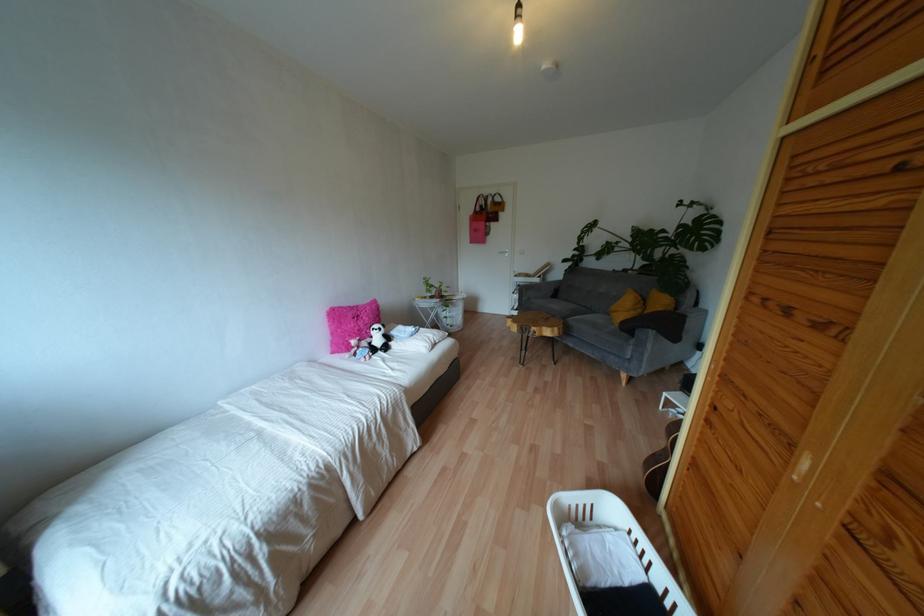
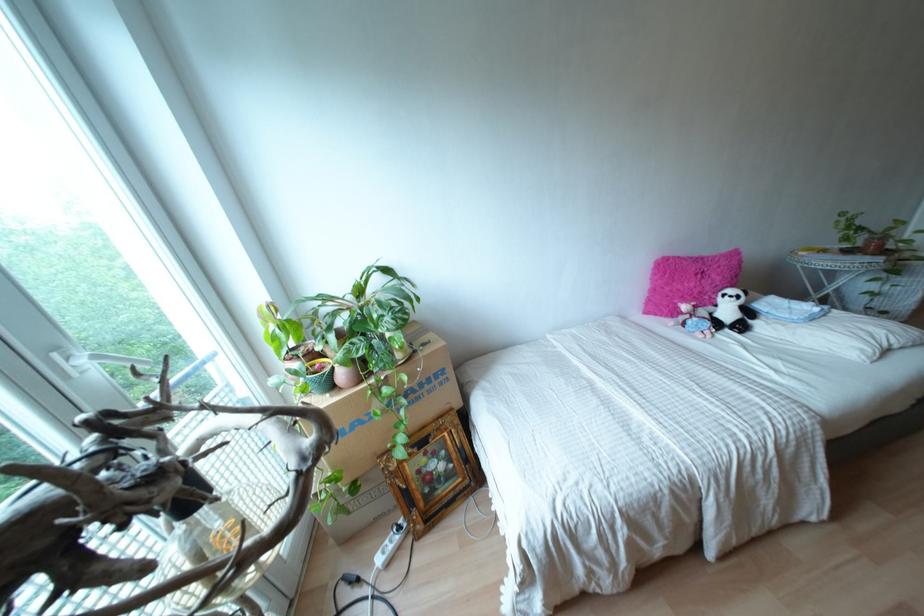
Where in the second image is the point corresponding to pixel 427 291 from the first image?

(845, 238)